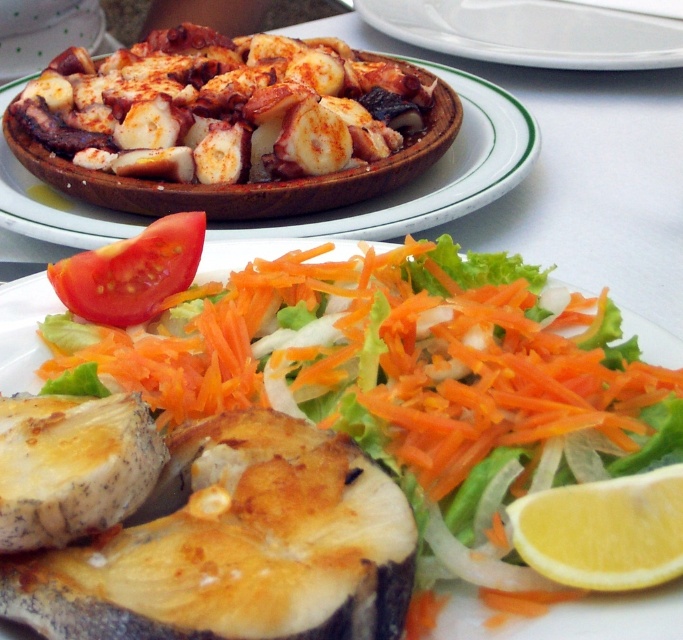
Is golden-brown fried fish at center wider than yellow smooth lemon at lower right?

Indeed, golden-brown fried fish at center has a greater width compared to yellow smooth lemon at lower right.

Between golden-brown fried fish at center and yellow smooth lemon at lower right, which one appears on the right side from the viewer's perspective?

yellow smooth lemon at lower right

Between point (568, 605) and point (613, 493), which one is positioned behind?

Positioned behind is point (613, 493).

Identify the location of golden-brown fried fish at center. The image size is (683, 640). (546, 605).

Is yellow smooth lemon at lower right taller than red smooth tomato at upper left?

No, yellow smooth lemon at lower right is not taller than red smooth tomato at upper left.

Is yellow smooth lemon at lower right positioned at the back of red smooth tomato at upper left?

No, it is not.

Image resolution: width=683 pixels, height=640 pixels. I want to click on yellow smooth lemon at lower right, so click(602, 531).

Is wooden plate at center below red smooth tomato at upper left?

No.

Is point (378, 216) farther from viewer compared to point (171, 228)?

Yes, point (378, 216) is behind point (171, 228).

At what (x,y) coordinates should I click in order to perform the action: click on wooden plate at center. Please return your answer as a coordinate pair (x, y). Looking at the image, I should click on (430, 172).